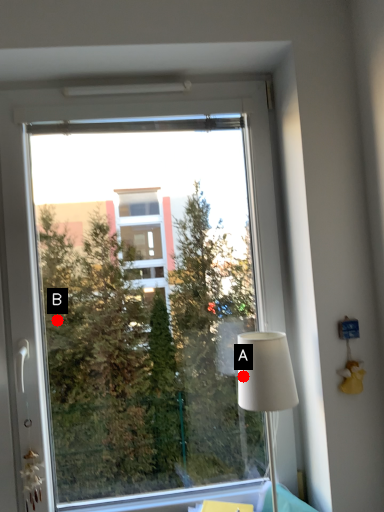
Question: Two points are circled on the image, labeled by A and B beside each circle. Which point is farther to the camera?

Choices:
 (A) A is further
 (B) B is further

Answer: (B)